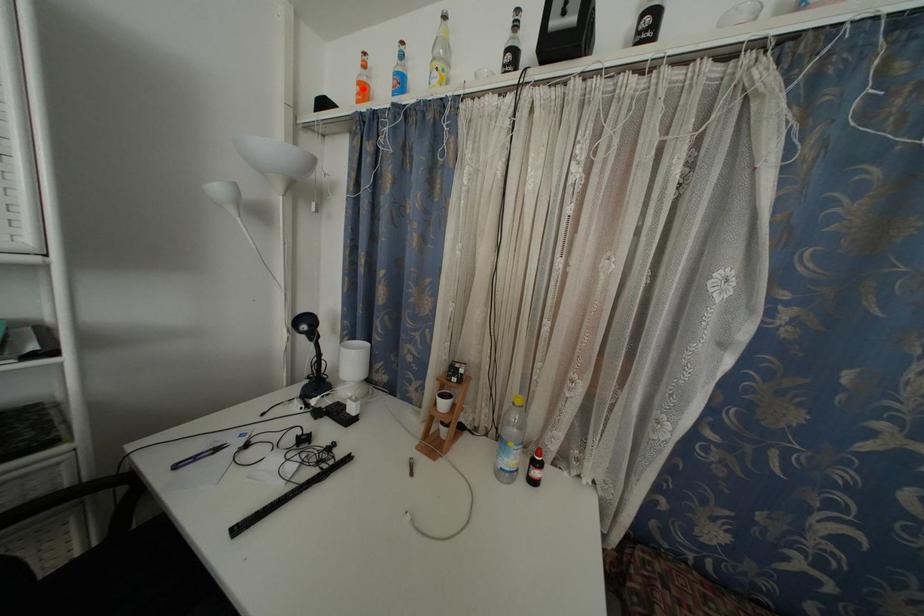
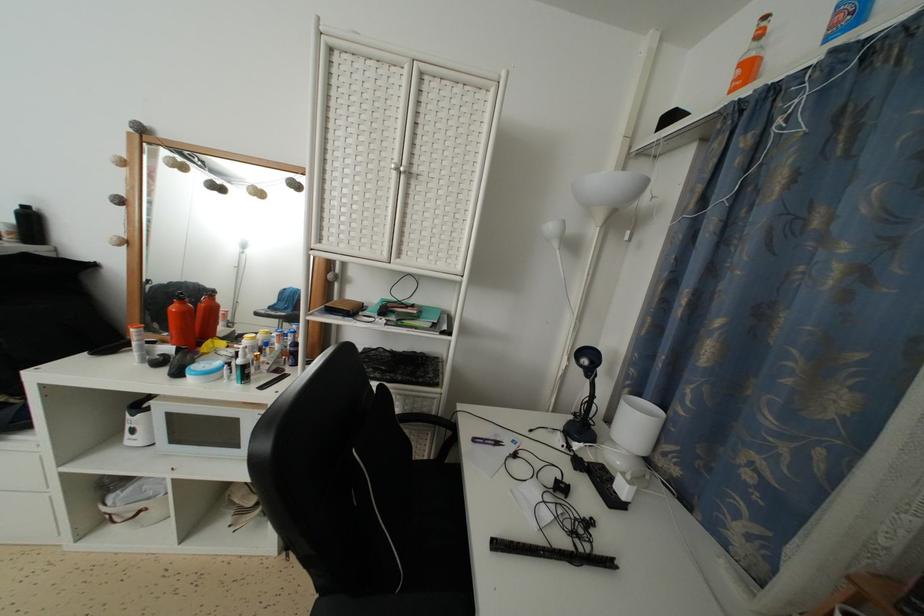
The point at the highlighted location is marked in the first image. Where is the corresponding point in the second image?

(746, 70)